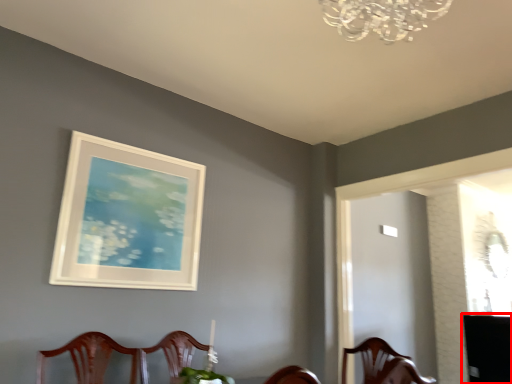
Question: Where is table (annotated by the red box) located in relation to picture frame in the image?

Choices:
 (A) right
 (B) left

Answer: (A)